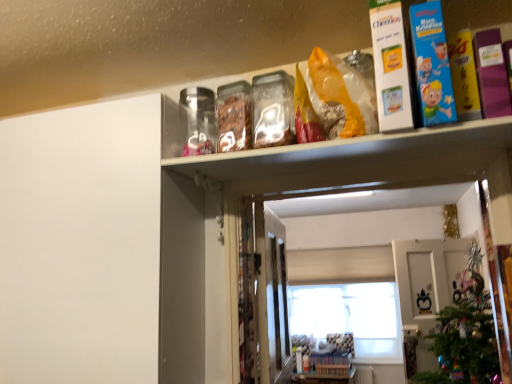
Question: Is white cardboard box at upper right, the first book when ordered from left to right, positioned before purple matte book at upper right, the 3th book when ordered from left to right?

Choices:
 (A) no
 (B) yes

Answer: (A)

Question: Considering the relative sizes of white cardboard box at upper right, positioned as the 3th book in right-to-left order, and purple matte book at upper right, the 3th book when ordered from left to right, in the image provided, is white cardboard box at upper right, positioned as the 3th book in right-to-left order, smaller than purple matte book at upper right, the 3th book when ordered from left to right,?

Choices:
 (A) no
 (B) yes

Answer: (A)

Question: Is white cardboard box at upper right, positioned as the 3th book in right-to-left order, behind purple matte book at upper right, the 3th book when ordered from left to right?

Choices:
 (A) no
 (B) yes

Answer: (B)

Question: Is white cardboard box at upper right, the first book when ordered from left to right, positioned far away from purple matte book at upper right, which is counted as the 1th book, starting from the right?

Choices:
 (A) no
 (B) yes

Answer: (A)

Question: Considering the relative sizes of white cardboard box at upper right, positioned as the 3th book in right-to-left order, and purple matte book at upper right, which is counted as the 1th book, starting from the right, in the image provided, is white cardboard box at upper right, positioned as the 3th book in right-to-left order, shorter than purple matte book at upper right, which is counted as the 1th book, starting from the right,?

Choices:
 (A) no
 (B) yes

Answer: (A)

Question: Is white cardboard box at upper right, positioned as the 3th book in right-to-left order, taller than purple matte book at upper right, the 3th book when ordered from left to right?

Choices:
 (A) yes
 (B) no

Answer: (A)

Question: Is the position of purple matte book at upper right, which is counted as the 1th book, starting from the right, less distant than that of white matte window at center?

Choices:
 (A) yes
 (B) no

Answer: (A)

Question: Does purple matte book at upper right, which is counted as the 1th book, starting from the right, have a smaller size compared to white matte window at center?

Choices:
 (A) yes
 (B) no

Answer: (A)

Question: From a real-world perspective, is purple matte book at upper right, the 3th book when ordered from left to right, positioned under white matte window at center based on gravity?

Choices:
 (A) no
 (B) yes

Answer: (A)

Question: Is purple matte book at upper right, the 3th book when ordered from left to right, wider than white matte window at center?

Choices:
 (A) yes
 (B) no

Answer: (A)

Question: From the image's perspective, is purple matte book at upper right, which is counted as the 1th book, starting from the right, on top of white matte window at center?

Choices:
 (A) no
 (B) yes

Answer: (B)

Question: Does purple matte book at upper right, which is counted as the 1th book, starting from the right, have a greater height compared to white matte window at center?

Choices:
 (A) yes
 (B) no

Answer: (B)

Question: Is green matte christmas tree at lower right at the right side of blue cardboard box at upper right, acting as the 2th book starting from the left?

Choices:
 (A) yes
 (B) no

Answer: (A)